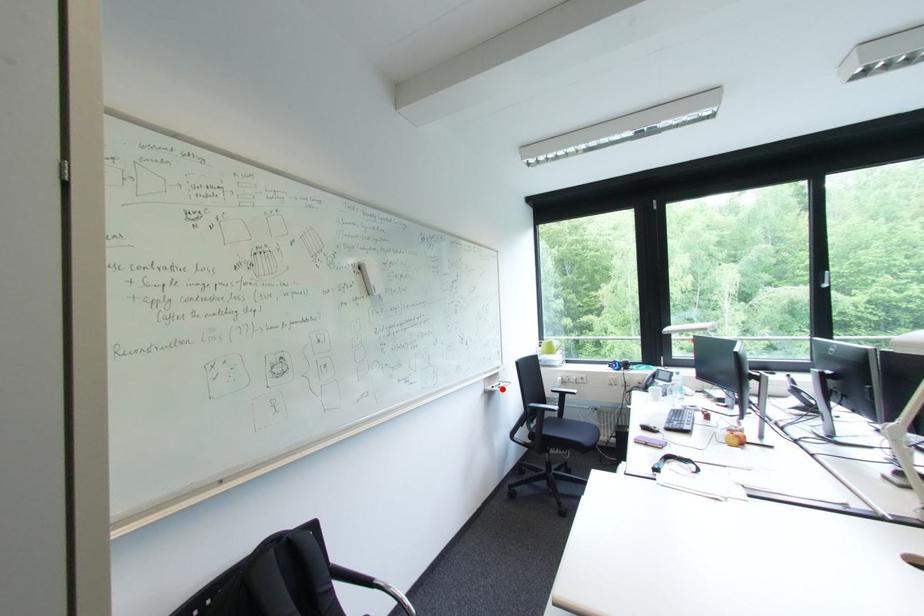
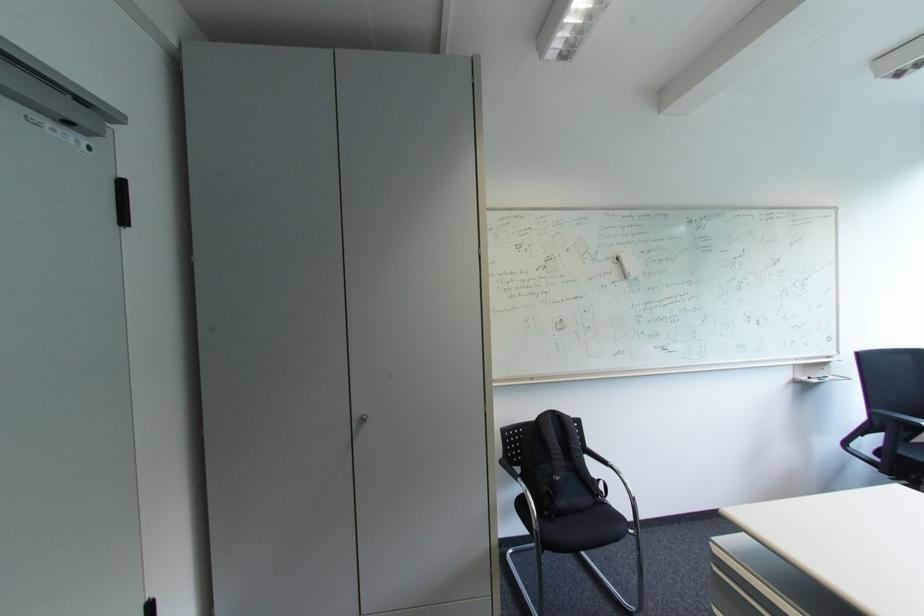
In the second image, find the point that corresponds to the highlighted location in the first image.

(819, 379)